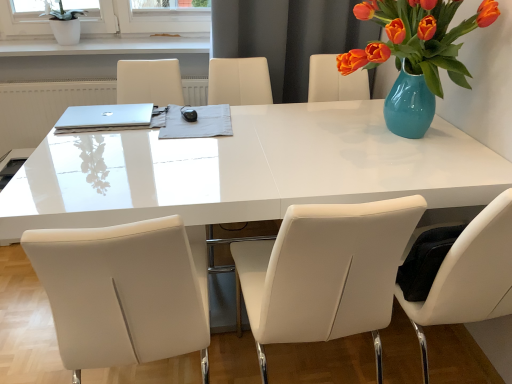
What do you see at coordinates (105, 116) in the screenshot?
I see `silver metallic laptop at upper left` at bounding box center [105, 116].

The width and height of the screenshot is (512, 384). Find the location of `white leather chair at center, the second chair from the left`. white leather chair at center, the second chair from the left is located at coordinates point(325,273).

Locate an element on the screen. The height and width of the screenshot is (384, 512). turquoise ceramic vase at upper right is located at coordinates (415, 53).

What are the coordinates of `gray fabric at center` in the screenshot? It's located at (197, 122).

In the scene shown: Considering the positions of objects white glossy table at center and silver metallic laptop at upper left in the image provided, who is behind, white glossy table at center or silver metallic laptop at upper left?

Positioned behind is silver metallic laptop at upper left.

Is point (342, 189) positioned after point (102, 110)?

No.

Which of these two, white glossy table at center or silver metallic laptop at upper left, is bigger?

Bigger between the two is white glossy table at center.

In order to click on notepad lying on the right of silver metallic laptop at upper left in this screenshot , I will do `click(197, 122)`.

Which is nearer, (79, 123) or (201, 123)?

The point (79, 123) is closer to the camera.

Is silver metallic laptop at upper left beside gray fabric at center?

There is a gap between silver metallic laptop at upper left and gray fabric at center.

Based on the photo, is silver metallic laptop at upper left oriented towards gray fabric at center?

No, silver metallic laptop at upper left does not turn towards gray fabric at center.

What's the angular difference between white ceramic pot at upper left and gray fabric at center's facing directions?

89 degrees.

Locate an element on the screen. The width and height of the screenshot is (512, 384). notepad located in front of the white ceramic pot at upper left is located at coordinates 197,122.

In the scene shown: Is the surface of white ceramic pot at upper left in direct contact with gray fabric at center?

white ceramic pot at upper left is not next to gray fabric at center, and they're not touching.

Is white ceramic pot at upper left located outside gray fabric at center?

Absolutely, white ceramic pot at upper left is external to gray fabric at center.

Which of these two, silver metallic laptop at upper left or turquoise ceramic vase at upper right, is wider?

turquoise ceramic vase at upper right.

Which is less distant, (89, 120) or (422, 68)?

Positioned in front is point (422, 68).

Who is taller, silver metallic laptop at upper left or turquoise ceramic vase at upper right?

turquoise ceramic vase at upper right is taller.

Is the position of white ceramic pot at upper left more distant than that of white leather chair at center, arranged as the first chair when viewed from the left?

Yes, white ceramic pot at upper left is further from the camera.

Which is in front, point (102, 12) or point (176, 220)?

The point (176, 220) is in front.

Is white ceramic pot at upper left facing away from white leather chair at center, the second chair positioned from the right?

No, white ceramic pot at upper left's orientation is not away from white leather chair at center, the second chair positioned from the right.

Can you confirm if white leather chair at center, the second chair from the left, is positioned to the right of silver metallic laptop at upper left?

Yes.

From the image's perspective, is white leather chair at center, placed as the first chair when sorted from right to left, located above silver metallic laptop at upper left?

Incorrect, from the image's perspective, white leather chair at center, placed as the first chair when sorted from right to left, is lower than silver metallic laptop at upper left.

From a real-world perspective, is white leather chair at center, the second chair from the left, on top of silver metallic laptop at upper left?

Actually, white leather chair at center, the second chair from the left, is physically below silver metallic laptop at upper left in the real world.

From a real-world perspective, who is located higher, white leather chair at center, the second chair positioned from the right, or white ceramic pot at upper left?

In real-world perspective, white ceramic pot at upper left is above.

At what (x,y) coordinates should I click in order to perform the action: click on the 2nd chair below when counting from the white ceramic pot at upper left (from the image's perspective). Please return your answer as a coordinate pair (x, y). The height and width of the screenshot is (384, 512). Looking at the image, I should click on (123, 292).

You are a GUI agent. You are given a task and a screenshot of the screen. Output one action in this format:
    pyautogui.click(x=<x>, y=<y>)
    Task: Click on the laptop on the left of white glossy table at center
    
    Given the screenshot: What is the action you would take?
    pyautogui.click(x=105, y=116)

Identify the location of notepad located below the silver metallic laptop at upper left (from the image's perspective). Image resolution: width=512 pixels, height=384 pixels. (197, 122).

Looking at the image, which one is located closer to white leather chair at center, the second chair positioned from the right, turquoise ceramic vase at upper right or white leather chair at center, the second chair from the left?

white leather chair at center, the second chair from the left.

Consider the image. Estimate the real-world distances between objects in this image. Which object is further from white ceramic pot at upper left, gray fabric at center or white glossy table at center?

Among the two, white glossy table at center is located further to white ceramic pot at upper left.

From the image, which object appears to be nearer to white leather chair at center, the second chair from the left, white glossy table at center or turquoise ceramic vase at upper right?

white glossy table at center is closer to white leather chair at center, the second chair from the left.

Looking at the image, which one is located further to white leather chair at center, the second chair positioned from the right, white glossy table at center or turquoise ceramic vase at upper right?

turquoise ceramic vase at upper right.

From the image, which object appears to be farther from white glossy table at center, silver metallic laptop at upper left or gray fabric at center?

The object further to white glossy table at center is silver metallic laptop at upper left.

Which object lies nearer to the anchor point white ceramic pot at upper left, gray fabric at center or turquoise ceramic vase at upper right?

gray fabric at center is positioned closer to the anchor white ceramic pot at upper left.

From the image, which object appears to be nearer to turquoise ceramic vase at upper right, white ceramic pot at upper left or white glossy table at center?

The object closer to turquoise ceramic vase at upper right is white glossy table at center.

Which object lies nearer to the anchor point turquoise ceramic vase at upper right, white leather chair at center, the second chair from the left, or silver metallic laptop at upper left?

white leather chair at center, the second chair from the left, is closer to turquoise ceramic vase at upper right.

Find the location of a particular element. laptop between white ceramic pot at upper left and white glossy table at center in the up-down direction is located at coordinates (105, 116).

You are a GUI agent. You are given a task and a screenshot of the screen. Output one action in this format:
    pyautogui.click(x=<x>, y=<y>)
    Task: Click on the notepad between white leather chair at center, the second chair positioned from the right, and white ceramic pot at upper left, along the z-axis
    The image size is (512, 384).
    Given the screenshot: What is the action you would take?
    pyautogui.click(x=197, y=122)

You are a GUI agent. You are given a task and a screenshot of the screen. Output one action in this format:
    pyautogui.click(x=<x>, y=<y>)
    Task: Click on the notepad between white leather chair at center, the second chair positioned from the right, and turquoise ceramic vase at upper right
    Image resolution: width=512 pixels, height=384 pixels.
    Given the screenshot: What is the action you would take?
    pyautogui.click(x=197, y=122)

Locate an element on the screen. The image size is (512, 384). chair between white leather chair at center, the second chair positioned from the right, and gray fabric at center from front to back is located at coordinates (325, 273).